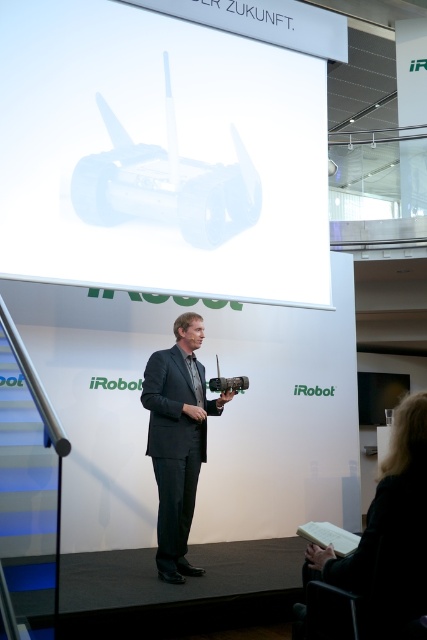
You are an event planner setting up the stage for a presentation. You need to ensure that the white glossy projector at upper center is visible to all attendees. Considering the dark gray suit at center, which object is taller and might block the view?

The white glossy projector at upper center is taller than the dark gray suit at center, so it is less likely to block the view as it stands higher.

You are an event organizer setting up for a presentation. You need to place a new banner that is 0.5 meters wide. The banner must be placed to the left of the white glossy projector at upper center without blocking the presenter. Can you fit the banner there?

The white glossy projector at upper center is located at point (160,156). Since the banner is 0.5 meters wide and needs to be placed to the left of the projector, you must check the available space. However, without knowing the exact dimensions of the stage or the distance between the projector and the edge, it is impossible to determine if the banner will fit without blocking the presenter. Additional measurements are required.

Consider the image. You are an event organizer who needs to adjust the lighting for the presentation. The white glossy projector at upper center and the dark gray suit at center are both in the room. Since the projector might cause glare, which object should you be more concerned about adjusting the lighting for?

The white glossy projector at upper center has a larger size compared to the dark gray suit at center, so it is more likely to cause glare and should be the focus of lighting adjustments.